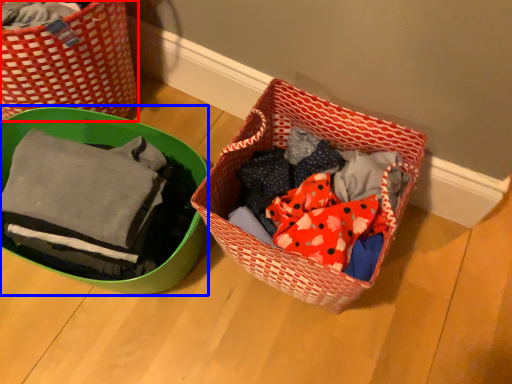
Question: Which object appears farthest to the camera in this image, picnic basket (highlighted by a red box) or gift basket (highlighted by a blue box)?

Choices:
 (A) picnic basket
 (B) gift basket

Answer: (A)